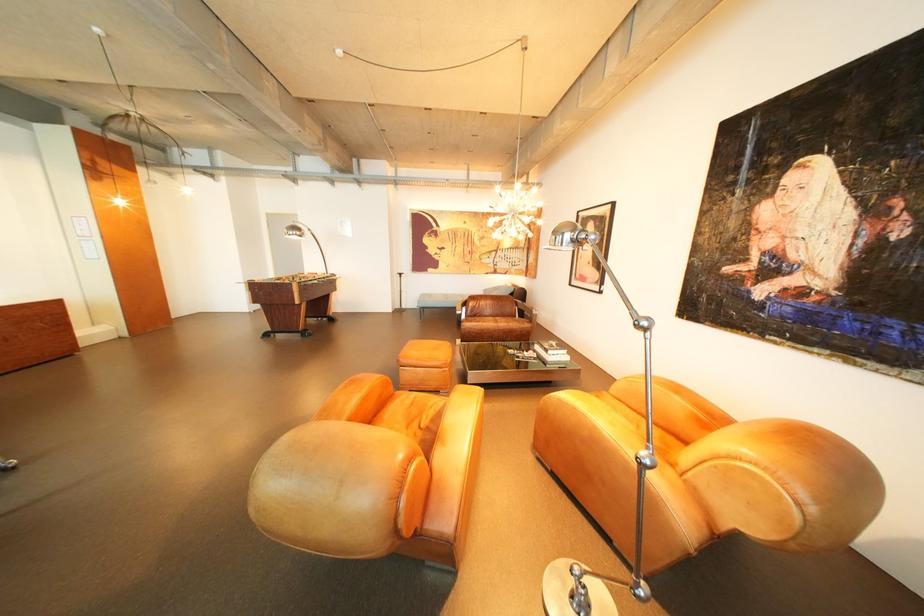
This screenshot has height=616, width=924. What do you see at coordinates (496, 321) in the screenshot? I see `a brown leather chair surface` at bounding box center [496, 321].